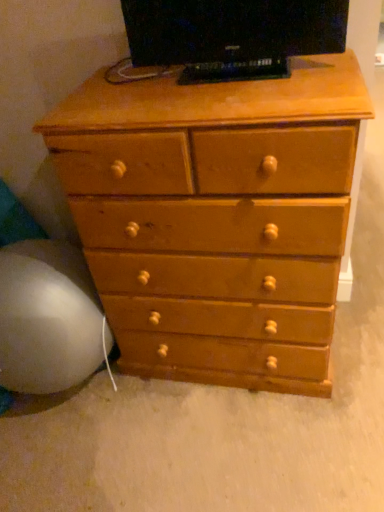
At what (x,y) coordinates should I click in order to perform the action: click on free location in front of white fabric bean bag at lower left. Please return your answer as a coordinate pair (x, y). This screenshot has height=512, width=384. Looking at the image, I should click on (83, 461).